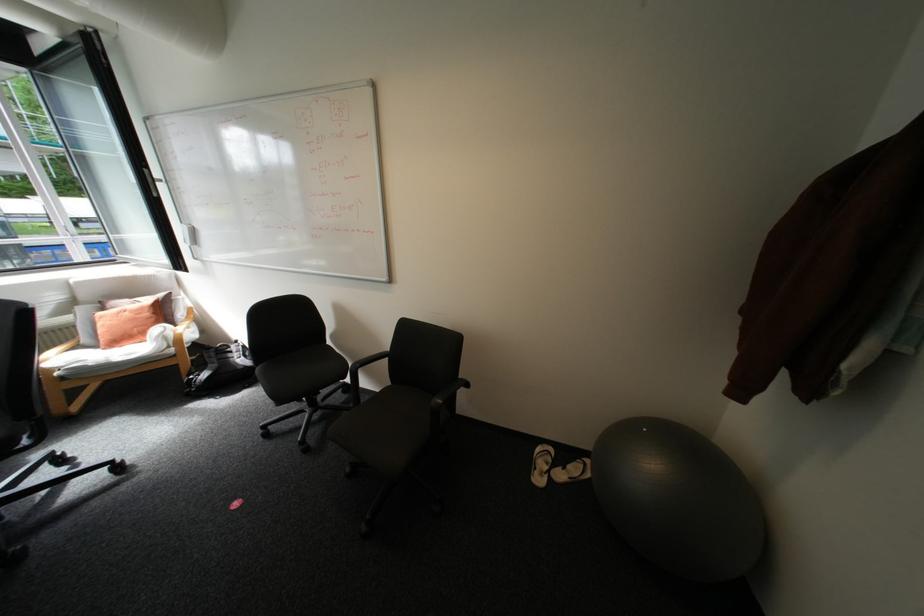
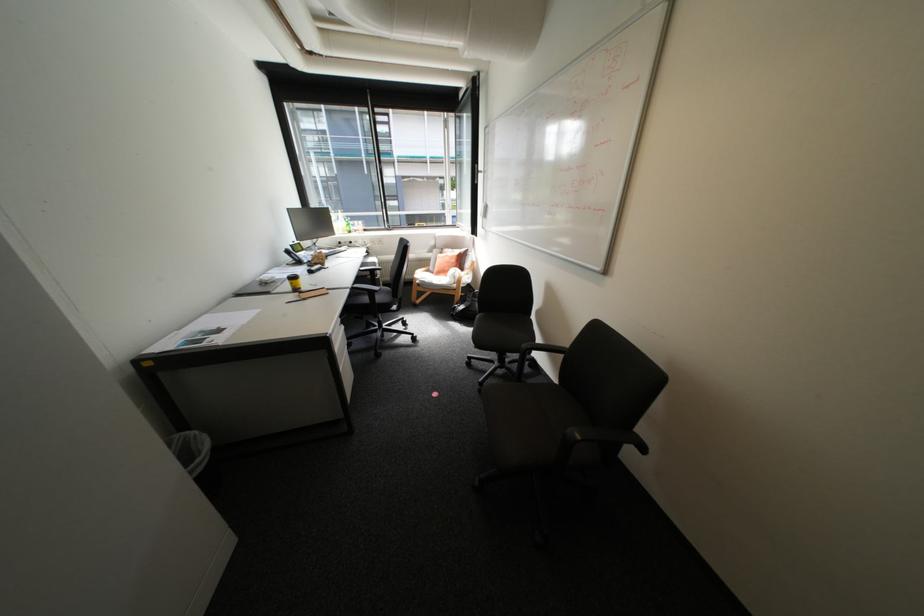
Find the pixel in the second image that matches the point at 369,366 in the first image.

(539, 347)